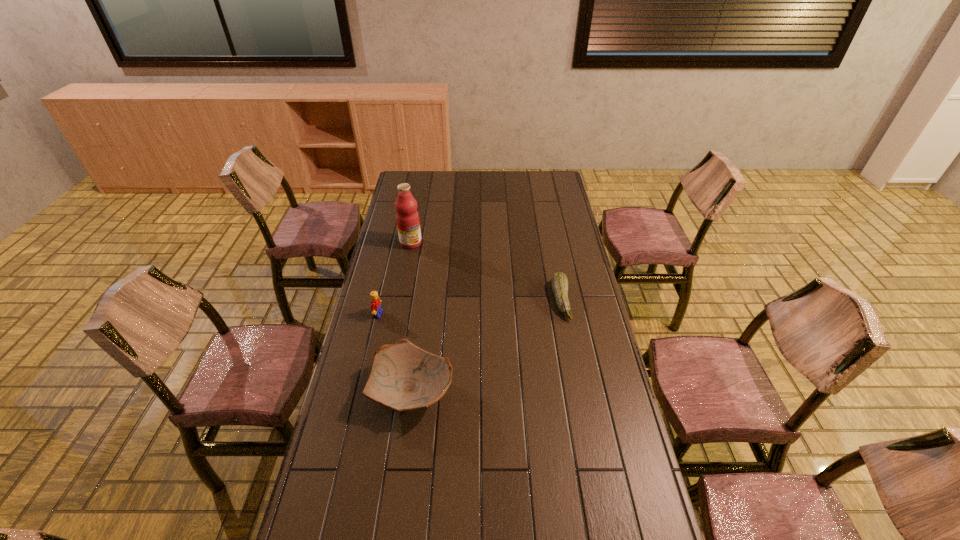
The image size is (960, 540). Find the location of `vacant space on the desktop that is between the pottery and the rightmost object and is positioned on the face of the Lego`. vacant space on the desktop that is between the pottery and the rightmost object and is positioned on the face of the Lego is located at coordinates (515, 328).

Image resolution: width=960 pixels, height=540 pixels. In order to click on free space on the desktop that is between the nearest object and the zucchini and is positioned on the label of the tallest object in this screenshot , I will do `click(485, 347)`.